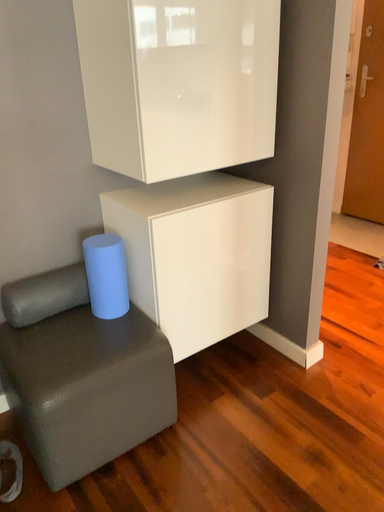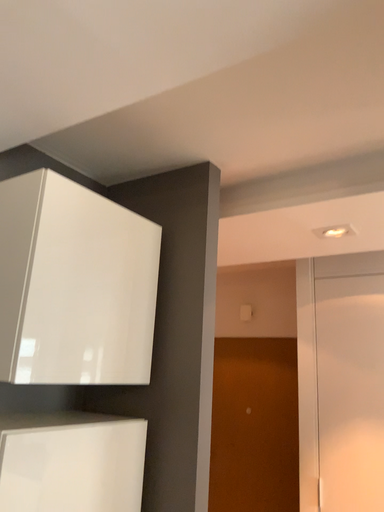
Question: Which way did the camera rotate in the video?

Choices:
 (A) rotated right
 (B) rotated left

Answer: (A)